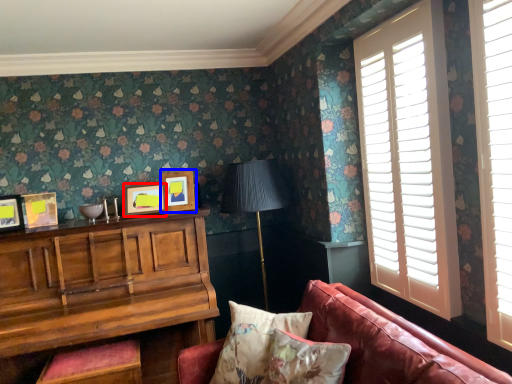
Question: Among these objects, which one is farthest to the camera, picture frame (highlighted by a red box) or picture frame (highlighted by a blue box)?

Choices:
 (A) picture frame
 (B) picture frame

Answer: (B)